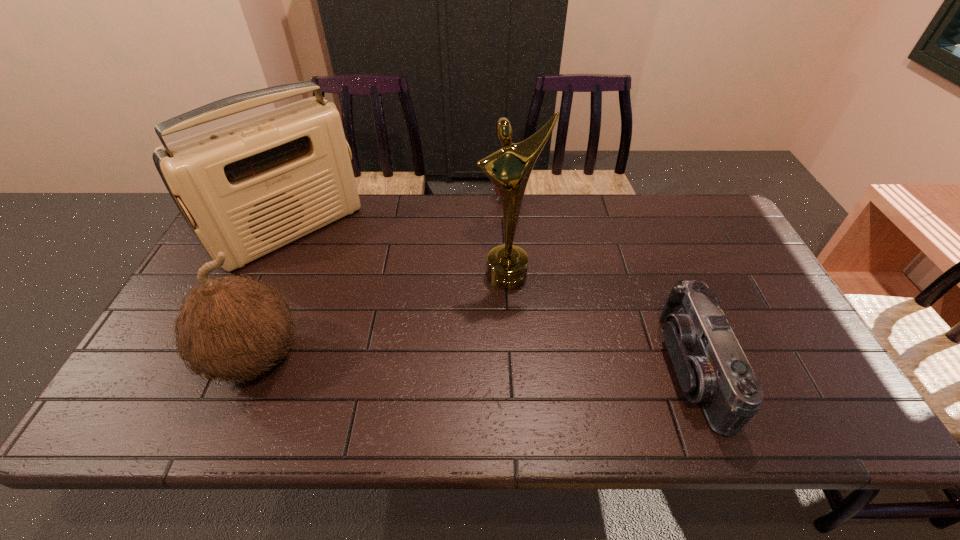
This screenshot has height=540, width=960. Find the location of `vacant space situated 0.290m on the front-facing side of the award`. vacant space situated 0.290m on the front-facing side of the award is located at coordinates (537, 382).

You are a GUI agent. You are given a task and a screenshot of the screen. Output one action in this format:
    pyautogui.click(x=<x>, y=<y>)
    Task: Click on the vacant space situated on the clock face of the alarm clock
    
    Given the screenshot: What is the action you would take?
    pyautogui.click(x=488, y=241)

Image resolution: width=960 pixels, height=540 pixels. In order to click on vacant area located 0.120m on the clock face of the alarm clock in this screenshot , I will do `click(493, 227)`.

This screenshot has height=540, width=960. Find the location of `vacant position located 0.210m on the clock face of the alarm clock`. vacant position located 0.210m on the clock face of the alarm clock is located at coordinates (486, 246).

Identify the location of vacant space located 0.180m on the front-facing side of the radio receiver. The height and width of the screenshot is (540, 960). (359, 296).

Where is `vacant space situated 0.050m on the front-facing side of the radio receiver`? The height and width of the screenshot is (540, 960). vacant space situated 0.050m on the front-facing side of the radio receiver is located at coordinates (334, 272).

Find the location of `free space located 0.390m on the front-facing side of the radio receiver`. free space located 0.390m on the front-facing side of the radio receiver is located at coordinates (406, 342).

The width and height of the screenshot is (960, 540). What are the coordinates of `alarm clock present at the far edge` in the screenshot? It's located at (495, 188).

Find the location of a particular element. This screenshot has height=540, width=960. radio receiver positioned at the far edge is located at coordinates (248, 188).

In order to click on coconut located in the near edge section of the desktop in this screenshot , I will do `click(232, 327)`.